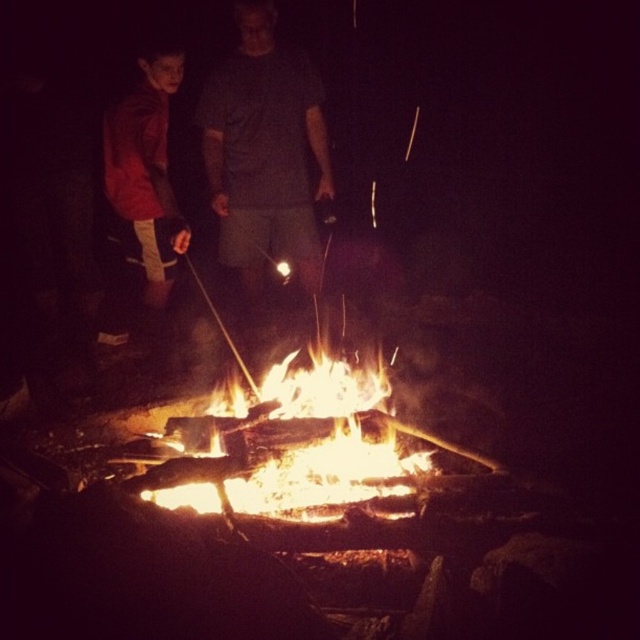
You are planning to take a photo of the campfire scene. You want to ensure that both the flaming wood fire at center and the matte red jacket at left are clearly visible in the frame. Based on their positions, which object should be placed closer to the left side of the photo?

The matte red jacket at left should be placed closer to the left side of the photo since it is positioned to the left of the flaming wood fire at center.

You are standing at the origin point of the coordinate system in this campfire scene. You need to locate the gray cotton shirt at center. What are the exact coordinates where it is positioned?

The gray cotton shirt at center is positioned at coordinates point [264,152].

You are a camper who wants to stay safe around the fire. The recommended safe distance from a campfire is at least 5 feet. Are you standing too close to the flaming wood fire at center if you are where the gray cotton shirt at center is positioned?

The gray cotton shirt at center is 4.38 feet from the flaming wood fire at center, which is less than the recommended 5 feet safe distance. Therefore, you are standing too close to the flaming wood fire at center.